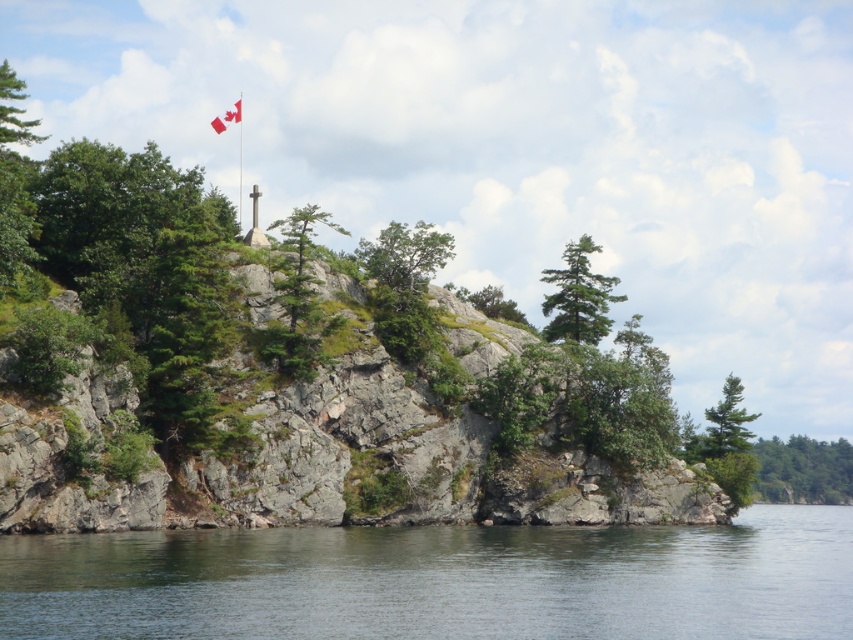
Is clear water at lower center thinner than metallic flag pole at upper center?

No.

Locate an element on the screen. This screenshot has height=640, width=853. clear water at lower center is located at coordinates (440, 580).

Who is more distant from viewer, (x=202, y=598) or (x=318, y=346)?

The point (x=318, y=346) is behind.

Find the location of a particular element. clear water at lower center is located at coordinates (440, 580).

Looking at this image, is green textured tree at center taller than green leafy tree at lower right?

Yes.

Between green textured tree at center and green leafy tree at lower right, which one is positioned lower?

Positioned lower is green leafy tree at lower right.

Who is more forward, [328,324] or [848,490]?

Point [328,324] is more forward.

Where is `green textured tree at center`? This screenshot has width=853, height=640. green textured tree at center is located at coordinates (296, 298).